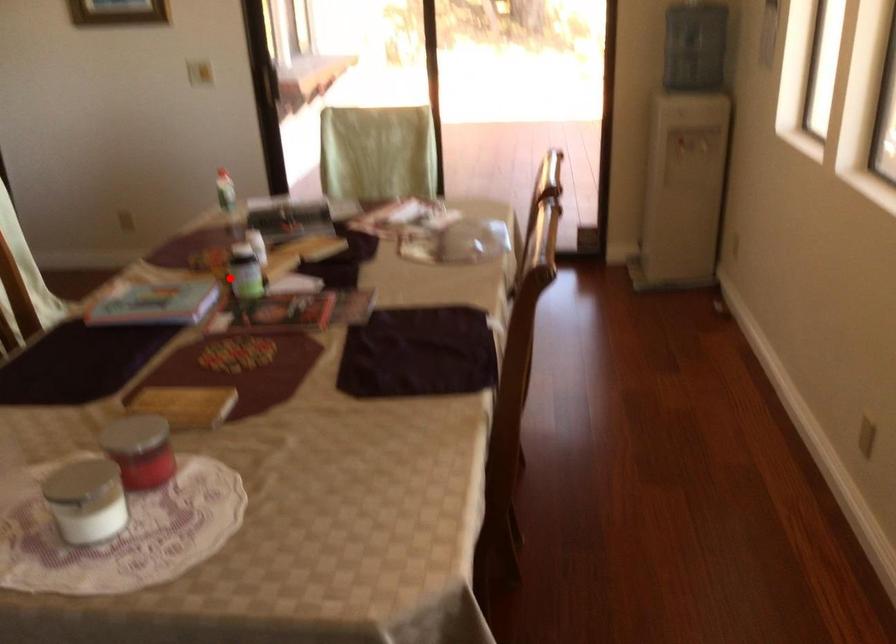
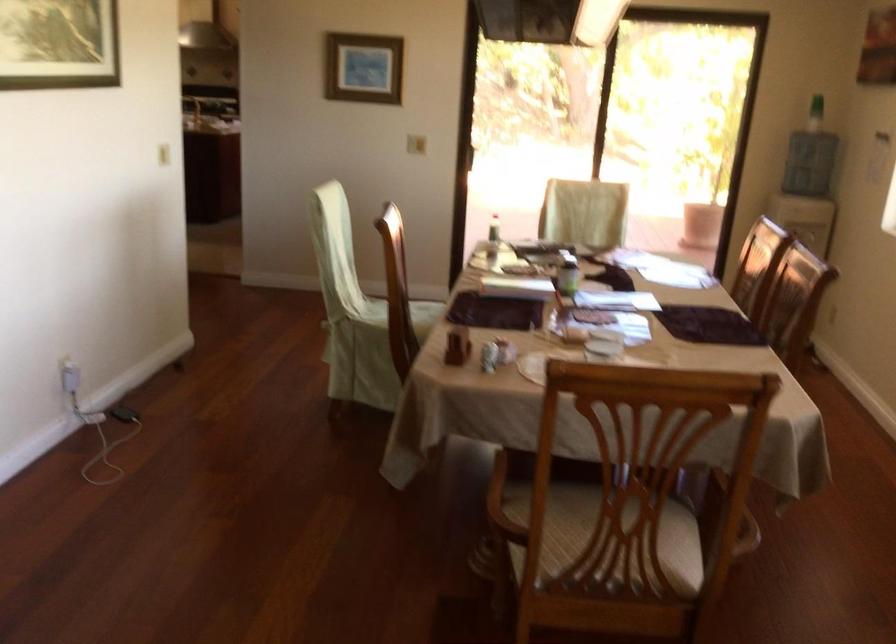
Question: I am providing you with two images of the same scene from different viewpoints. Given a red point in image1, look at the same physical point in image2. Is it:

Choices:
 (A) Closer to the viewpoint
 (B) Farther from the viewpoint

Answer: (B)